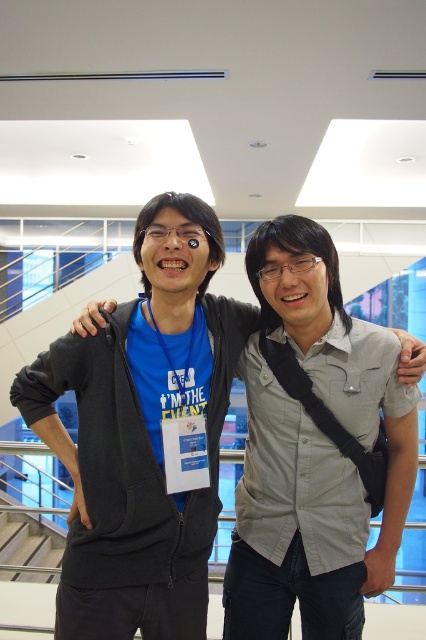
Can you confirm if blue cotton t-shirt at center is shorter than gray cotton shirt at center?

Yes.

Is blue cotton t-shirt at center closer to the viewer compared to gray cotton shirt at center?

That is True.

Where is `blue cotton t-shirt at center`? blue cotton t-shirt at center is located at coordinates (141, 435).